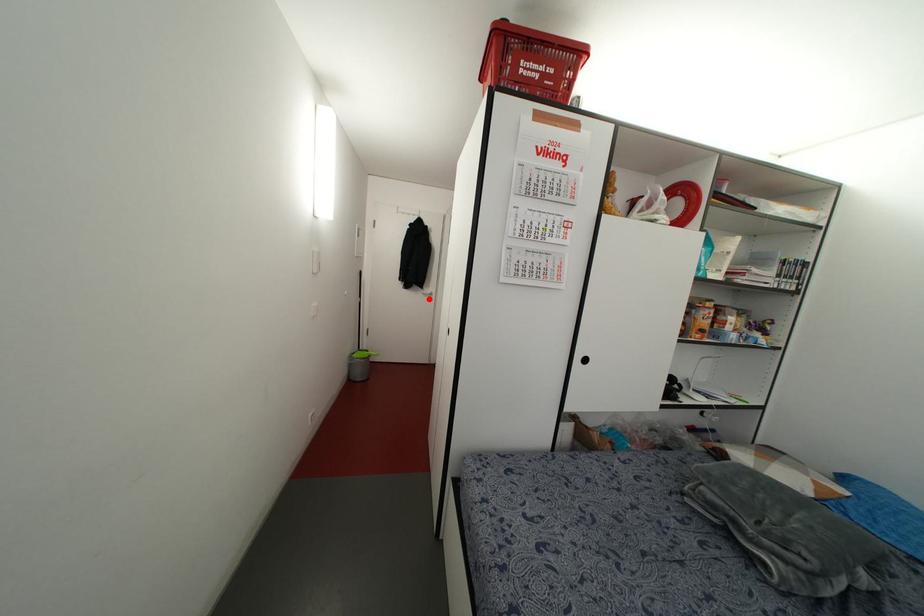
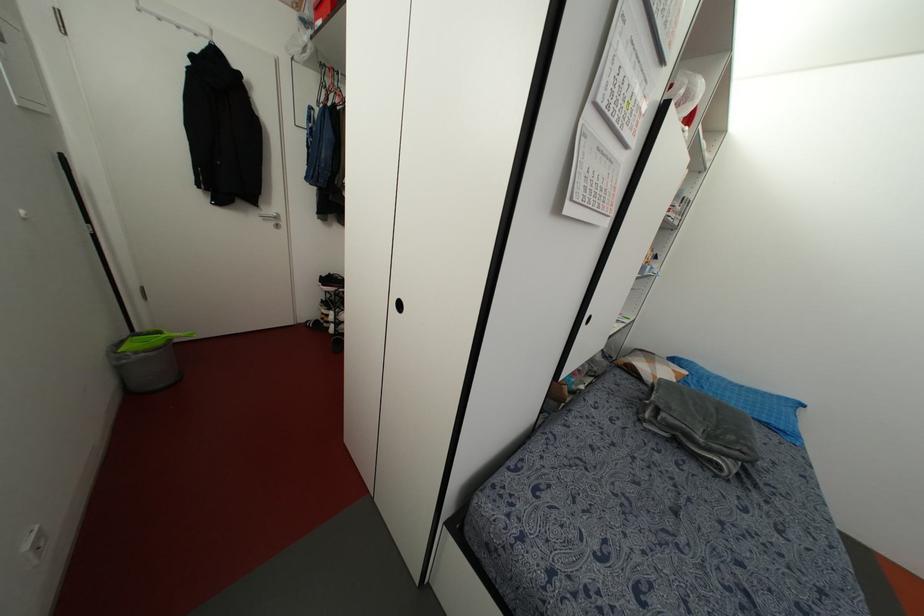
Where in the second image is the point corresponding to the highlighted location from the first image?

(276, 225)